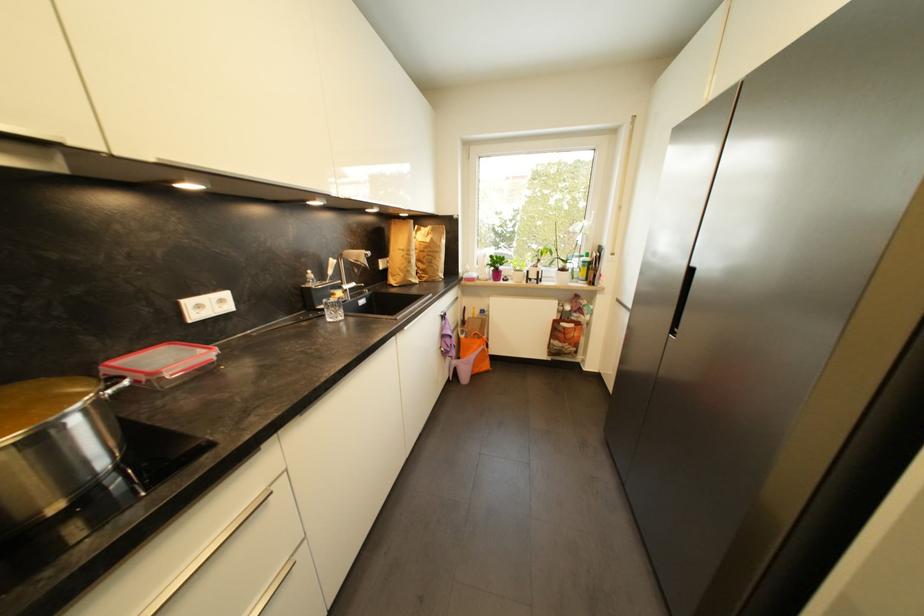
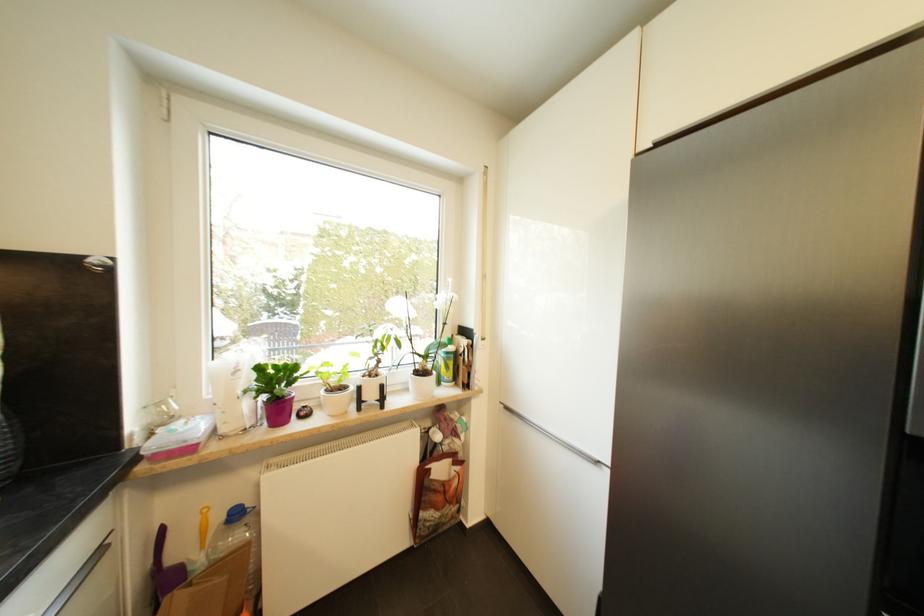
Find the pixel in the second image that matches [564,272] in the first image.

(421, 375)